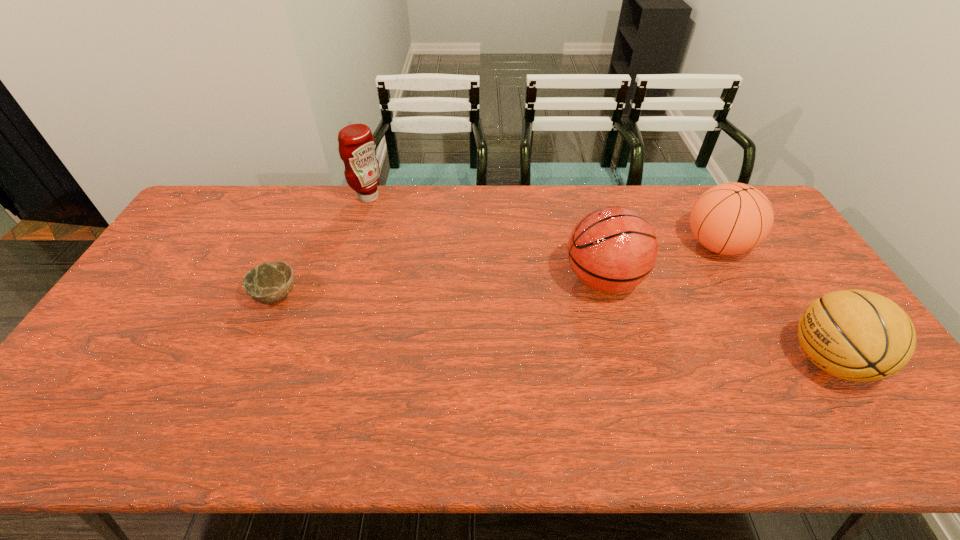
Find the location of a particular element. Image resolution: width=960 pixels, height=540 pixels. the second object from left to right is located at coordinates (356, 147).

This screenshot has height=540, width=960. Identify the location of the farthest object. (356, 147).

In order to click on the third object from left to right in this screenshot , I will do `click(612, 249)`.

What are the coordinates of `the nearest object` in the screenshot? It's located at (857, 335).

You are a GUI agent. You are given a task and a screenshot of the screen. Output one action in this format:
    pyautogui.click(x=<x>, y=<y>)
    Task: Click on the leftmost object
    The image size is (960, 540).
    Given the screenshot: What is the action you would take?
    pyautogui.click(x=267, y=283)

Find the location of a particular element. This screenshot has width=960, height=540. bowl is located at coordinates click(267, 283).

What are the coordinates of `free space located 0.250m on the left of the second object from left to right` in the screenshot? It's located at (284, 197).

Identify the location of free spot located 0.330m on the side with spill of the third object from right to left. (452, 280).

The width and height of the screenshot is (960, 540). Find the location of `blank space located on the side with spill of the third object from right to left`. blank space located on the side with spill of the third object from right to left is located at coordinates (502, 280).

At what (x,y) coordinates should I click in order to perform the action: click on vacant space situated 0.160m on the side with spill of the third object from right to left. Please return your answer as a coordinate pair (x, y). The height and width of the screenshot is (540, 960). Looking at the image, I should click on (509, 280).